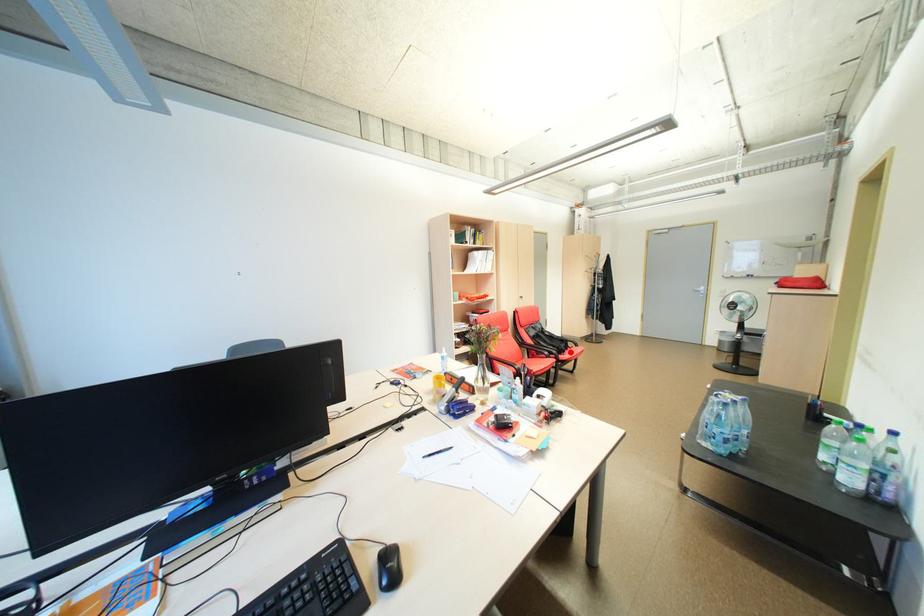
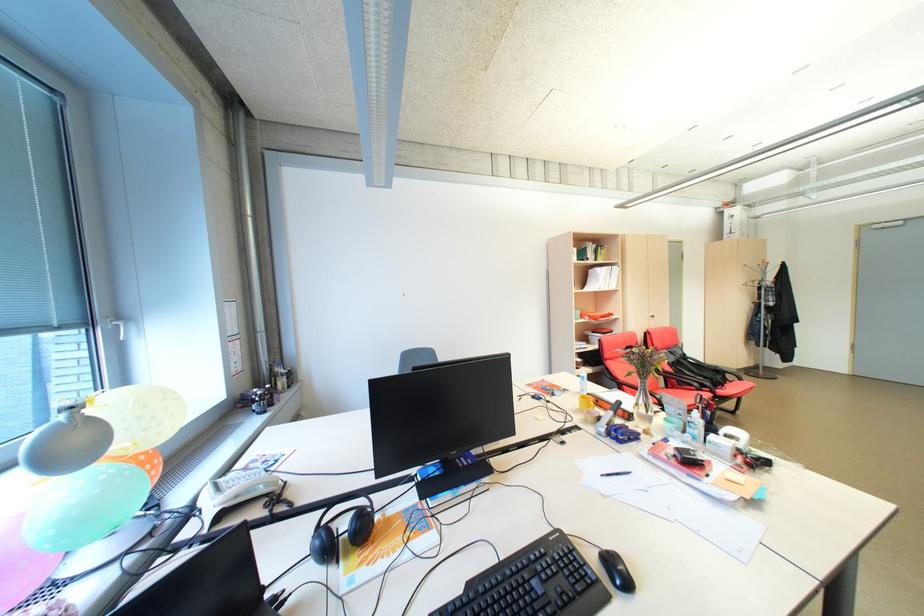
Find the pixel in the second image that matches the highlighted location in the first image.

(727, 386)